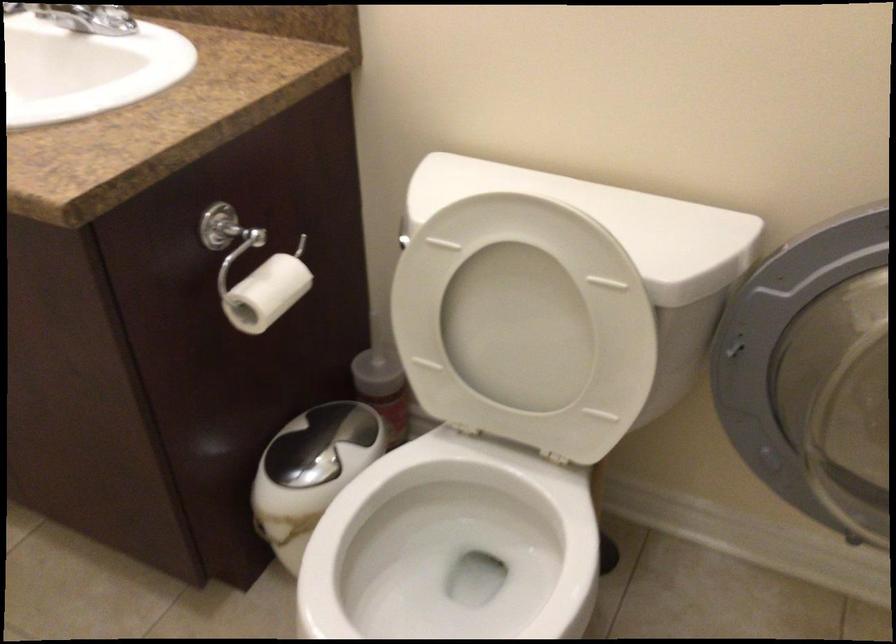
This screenshot has height=644, width=896. I want to click on toilet flush handle, so click(x=401, y=237).